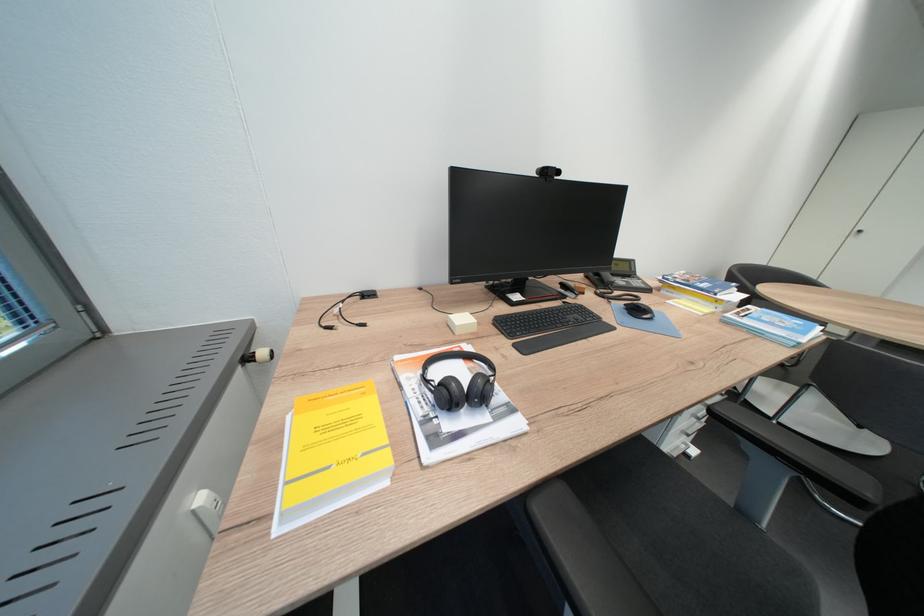
Where would you pull the silver cabinet handle? Please return your answer as a coordinate pair (x, y).

(857, 231)